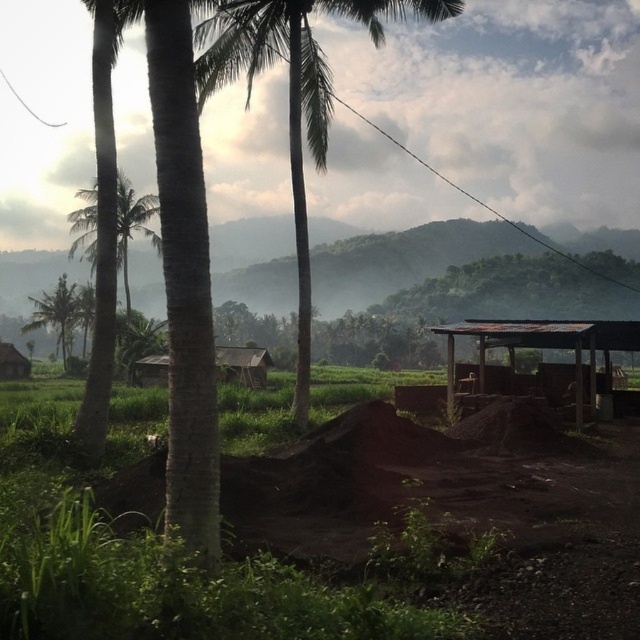
You are standing in the rural landscape and want to take a photo of the brown wooden hut at center without the green leafy palm tree at upper left blocking the view. Which direction should you move to ensure the palm tree is out of frame?

Move to the right side of the brown wooden hut at center so that the green leafy palm tree at upper left is no longer blocking the view.

You are planning to build a new garden shed in your backyard. You have two options for placement based on the image provided. The first option is to place it where the rusty metal shelter at lower right is located, and the second option is where the green leafy palm tree at upper left is situated. Considering the available space, which location would allow for a larger structure?

The green leafy palm tree at upper left occupies more space than the rusty metal shelter at lower right, so placing the shed where the green leafy palm tree at upper left is would allow for a larger structure.